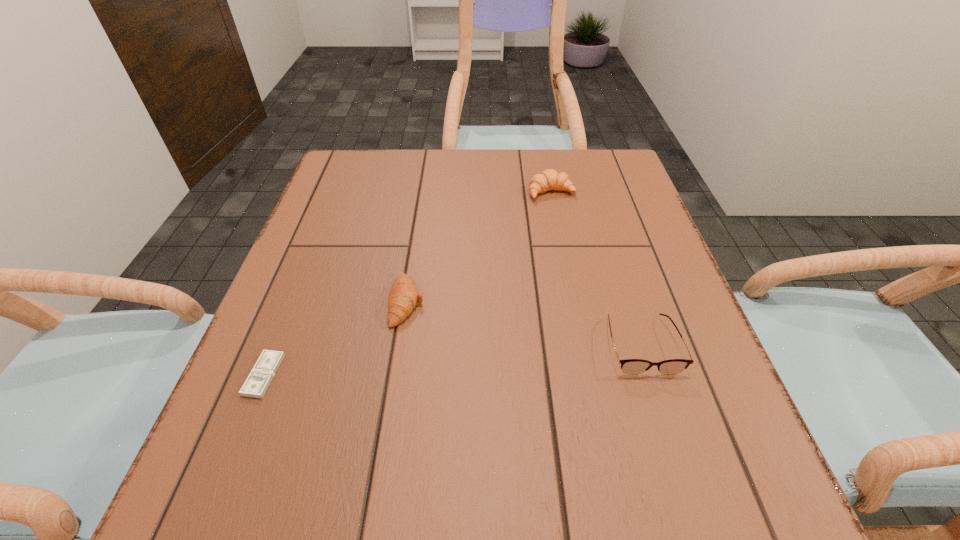
Locate an element on the screen. The image size is (960, 540). the right crescent roll is located at coordinates (549, 179).

The width and height of the screenshot is (960, 540). Identify the location of the taller crescent roll. (549, 179).

The height and width of the screenshot is (540, 960). I want to click on spectacles, so (x=629, y=366).

You are a GUI agent. You are given a task and a screenshot of the screen. Output one action in this format:
    pyautogui.click(x=<x>, y=<y>)
    Task: Click on the shorter crescent roll
    
    Given the screenshot: What is the action you would take?
    pyautogui.click(x=403, y=297)

Identify the location of the second object from left to right. (403, 297).

You are a GUI agent. You are given a task and a screenshot of the screen. Output one action in this format:
    pyautogui.click(x=<x>, y=<y>)
    Task: Click on the shortest object
    The height and width of the screenshot is (540, 960).
    Given the screenshot: What is the action you would take?
    pyautogui.click(x=259, y=379)

Image resolution: width=960 pixels, height=540 pixels. I want to click on the leftmost object, so click(x=259, y=379).

You are a GUI agent. You are given a task and a screenshot of the screen. Output one action in this format:
    pyautogui.click(x=<x>, y=<y>)
    Task: Click on the vacant area situated 0.250m on the front of the right crescent roll
    
    Given the screenshot: What is the action you would take?
    pyautogui.click(x=568, y=276)

Locate an element on the screen. free region located on the face of the spectacles is located at coordinates (669, 433).

Locate an element on the screen. The image size is (960, 540). vacant space located 0.200m on the back of the left crescent roll is located at coordinates (420, 217).